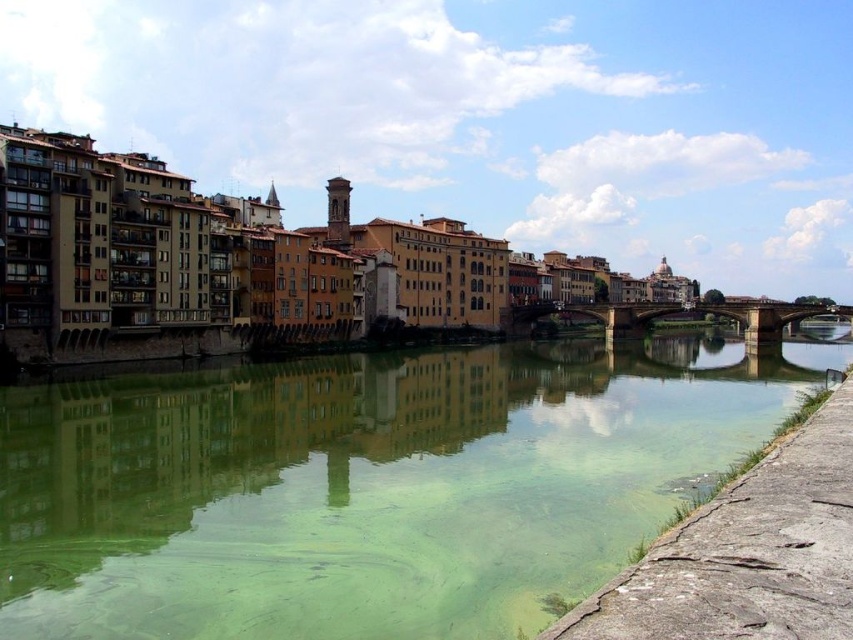
You are a tourist standing on the riverside path. You want to take a photo that includes both the green translucent water at lower center and the stone bridge at center. Which object should you frame first to ensure both are visible in the photo?

The green translucent water at lower center is larger in size than the stone bridge at center, so you should frame the green translucent water at lower center first to ensure both are visible in the photo.

You are standing at the point marked by coordinates point (366,486). What is the object located at your current position?

The point (366,486) corresponds to the green translucent water at lower center.

You are standing at the center of the image and want to locate the green translucent water at lower center. In which direction should you look to find it?

The green translucent water at lower center is located at point 0.761 on the x axis and 0.430 on the y axis. Since the coordinates are given in normalized image coordinates, the x value of 0.761 indicates it is to the right side of the image, and the y value of 0.430 indicates it is slightly below the center. Therefore, you should look to the right and slightly downward from the center to locate the green translucent water at lower center.